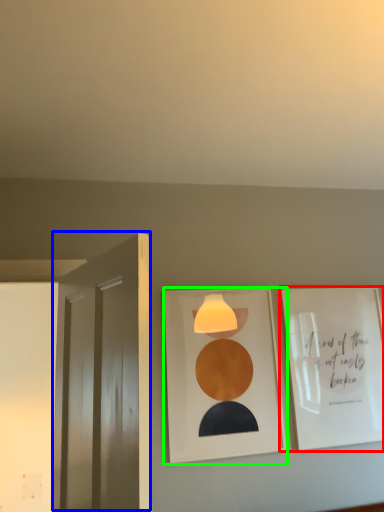
Question: Which object is positioned farthest from picture frame (highlighted by a red box)? Select from door (highlighted by a blue box) and picture frame (highlighted by a green box).

Choices:
 (A) door
 (B) picture frame

Answer: (A)